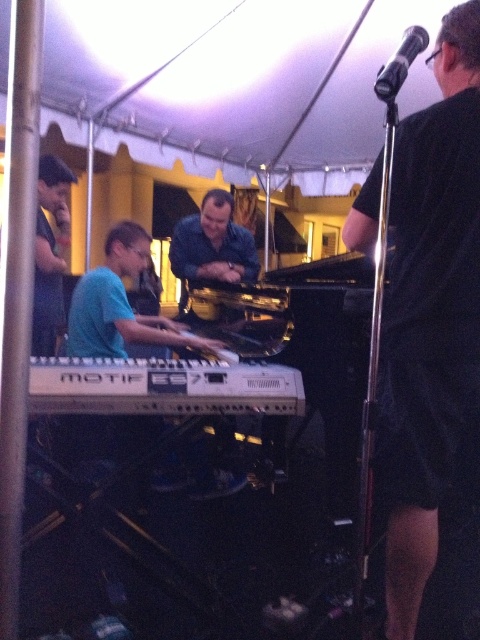
Question: Is white plastic keyboard at lower center smaller than teal matte keyboard at center?

Choices:
 (A) no
 (B) yes

Answer: (B)

Question: Which object is the closest to the white plastic keyboard at lower center?

Choices:
 (A) black metallic microphone at upper right
 (B) black matte shirt at right
 (C) teal matte keyboard at center

Answer: (B)

Question: Does black matte shirt at right appear on the left side of black metallic microphone at upper right?

Choices:
 (A) no
 (B) yes

Answer: (A)

Question: Considering the real-world distances, which object is closest to the black matte shirt at right?

Choices:
 (A) black metallic microphone at upper right
 (B) teal matte keyboard at center
 (C) white plastic keyboard at lower center

Answer: (C)

Question: Does black matte shirt at right appear under teal matte keyboard at center?

Choices:
 (A) yes
 (B) no

Answer: (A)

Question: Among these objects, which one is nearest to the camera?

Choices:
 (A) white plastic keyboard at lower center
 (B) teal matte keyboard at center
 (C) black matte shirt at right
 (D) black metallic microphone at upper right

Answer: (A)